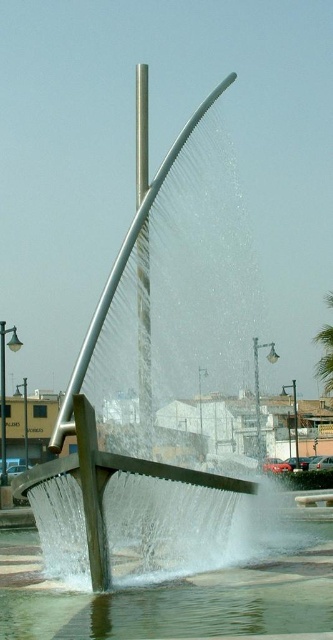
Question: Does clear water at base center appear on the right side of green leafy palm tree at upper right?

Choices:
 (A) yes
 (B) no

Answer: (B)

Question: Can you confirm if clear water at base center is wider than green leafy palm tree at upper right?

Choices:
 (A) yes
 (B) no

Answer: (A)

Question: Which point appears closest to the camera in this image?

Choices:
 (A) pyautogui.click(x=303, y=540)
 (B) pyautogui.click(x=325, y=337)

Answer: (A)

Question: Can you confirm if clear water at base center is thinner than green leafy palm tree at upper right?

Choices:
 (A) no
 (B) yes

Answer: (A)

Question: Which of the following is the closest to the observer?

Choices:
 (A) (163, 620)
 (B) (332, 365)

Answer: (A)